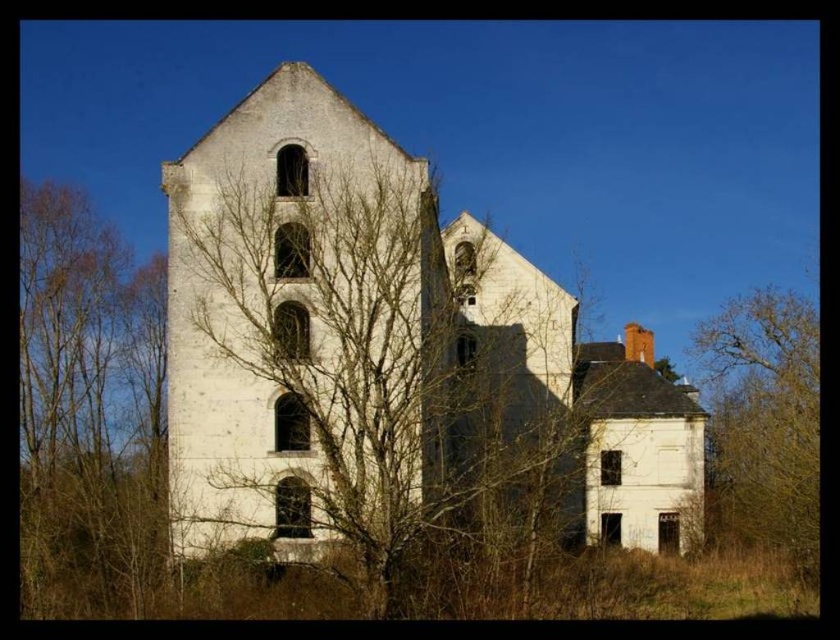
You are standing in front of the abandoned building and want to take a photo. You notice two points marked in the scene. The first point is at coordinates point (88, 372) and the second is at point (735, 426). Which point appears closer to you in the image?

Point (88, 372) is closer to the camera than point (735, 426), so it will appear closer in the image.